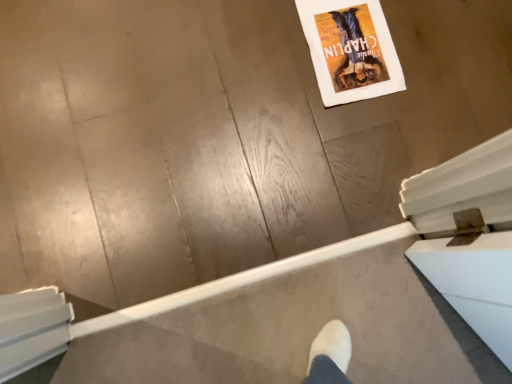
Locate an element on the screen. The width and height of the screenshot is (512, 384). blank space above white paper towel at upper center (from a real-world perspective) is located at coordinates (344, 41).